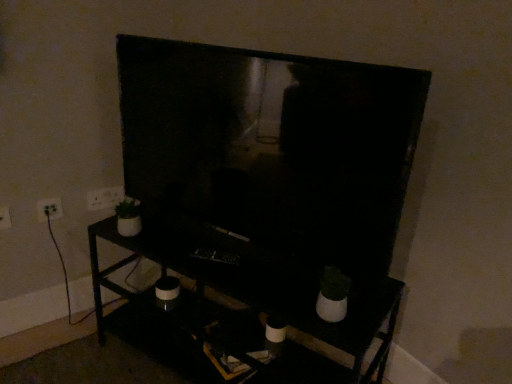
Question: From a real-world perspective, is white plastic electric outlet at upper left, marked as the 3th electric outlet in a front-to-back arrangement, physically located above or below white plastic electric outlet at left, the 1th electric outlet positioned from the front?

Choices:
 (A) above
 (B) below

Answer: (A)

Question: In terms of width, does white plastic electric outlet at upper left, marked as the 3th electric outlet in a front-to-back arrangement, look wider or thinner when compared to white plastic electric outlet at left, the 1th electric outlet positioned from the front?

Choices:
 (A) wide
 (B) thin

Answer: (B)

Question: Considering the real-world distances, which object is closest to the white plastic electric outlet at upper left, the 1th electric outlet viewed from the right?

Choices:
 (A) black matte tv stand at center
 (B) white plastic electric outlet at left, marked as the second electric outlet in a right-to-left arrangement
 (C) matte black tv at center
 (D) white plastic electric outlet at left, the third electric outlet positioned from the right

Answer: (B)

Question: Which is farther from the white plastic electric outlet at left, acting as the first electric outlet starting from the left?

Choices:
 (A) white plastic electric outlet at upper left, the 1th electric outlet viewed from the right
 (B) white plastic electric outlet at left, which appears as the 2th electric outlet when viewed from the left
 (C) black matte tv stand at center
 (D) matte black tv at center

Answer: (D)